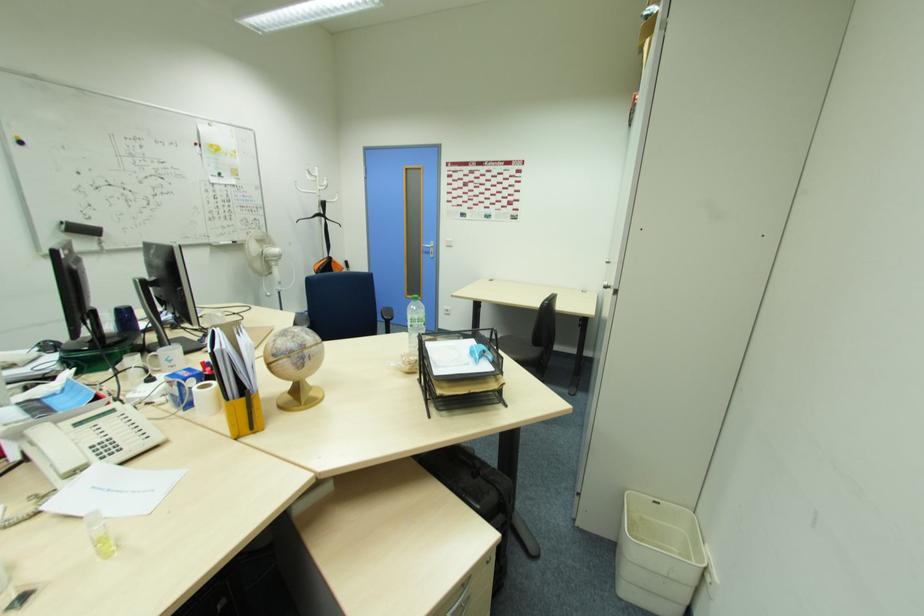
The height and width of the screenshot is (616, 924). Describe the element at coordinates (207, 398) in the screenshot. I see `the white mug handle` at that location.